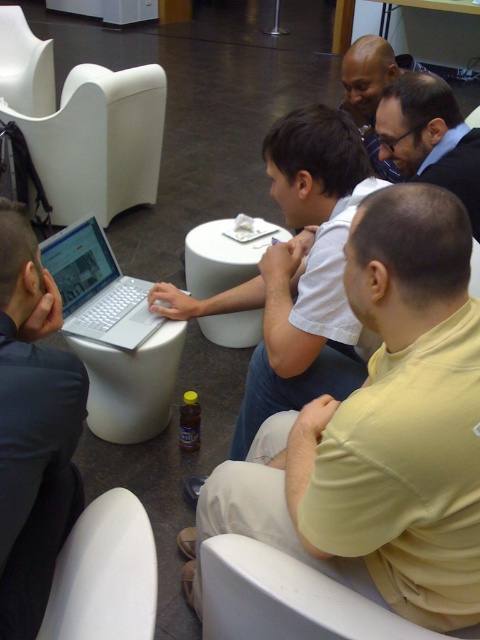
Between point (112, 300) and point (216, 225), which one is positioned behind?

Point (216, 225)

Between point (115, 336) and point (235, 256), which one is positioned in front?

Point (115, 336) is in front.

Is point (81, 269) positioned after point (285, 237)?

That is False.

Find the location of `silver metallic laptop at center`. silver metallic laptop at center is located at coordinates (97, 289).

Between white plastic stool at lower left and white plastic stool at center, which one appears on the left side from the viewer's perspective?

white plastic stool at lower left

Can you confirm if white plastic stool at lower left is bigger than white plastic stool at center?

Actually, white plastic stool at lower left might be smaller than white plastic stool at center.

Identify the location of white plastic stool at lower left. The image size is (480, 640). (131, 384).

Is white cotton shirt at center thinner than white matte chair at upper left?

Yes.

Can you confirm if white cotton shirt at center is bigger than white matte chair at upper left?

Indeed, white cotton shirt at center has a larger size compared to white matte chair at upper left.

You are a GUI agent. You are given a task and a screenshot of the screen. Output one action in this format:
    pyautogui.click(x=<x>, y=<y>)
    Task: Click on the white cotton shirt at center
    The width and height of the screenshot is (480, 640).
    Given the screenshot: What is the action you would take?
    pyautogui.click(x=380, y=432)